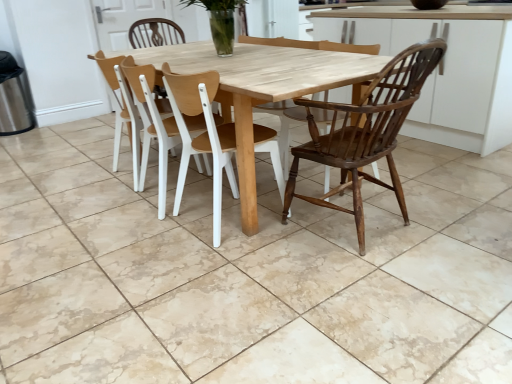
Find the location of a particular element. The width and height of the screenshot is (512, 384). vacant point to the left of light wood table at center is located at coordinates (58, 180).